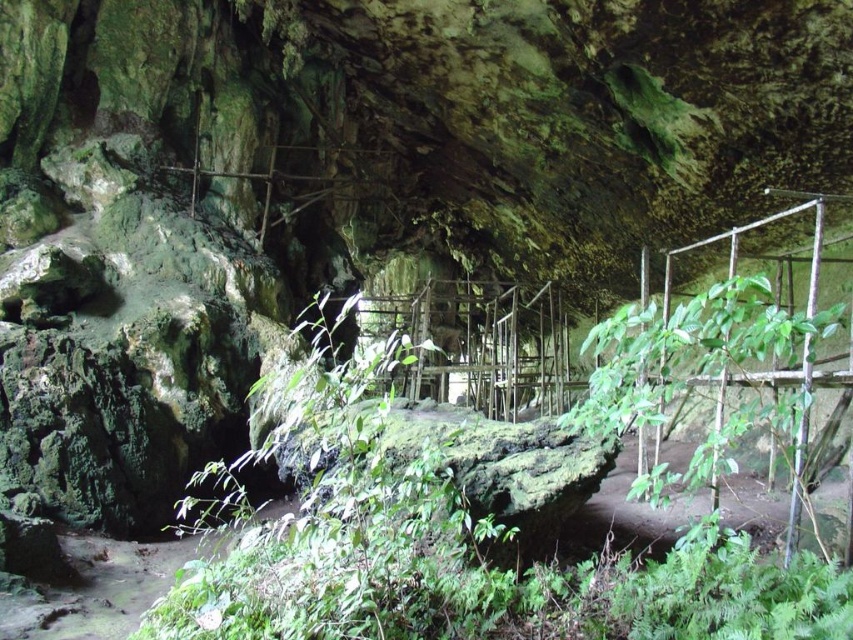
Can you confirm if green leafy plant at center is smaller than green leafy plant at center right?

Yes, green leafy plant at center is smaller than green leafy plant at center right.

Who is positioned more to the right, green leafy plant at center or green leafy plant at center right?

Positioned to the right is green leafy plant at center right.

Where is `green leafy plant at center`? The width and height of the screenshot is (853, 640). green leafy plant at center is located at coordinates (492, 515).

The width and height of the screenshot is (853, 640). What are the coordinates of `green leafy plant at center` in the screenshot? It's located at (492, 515).